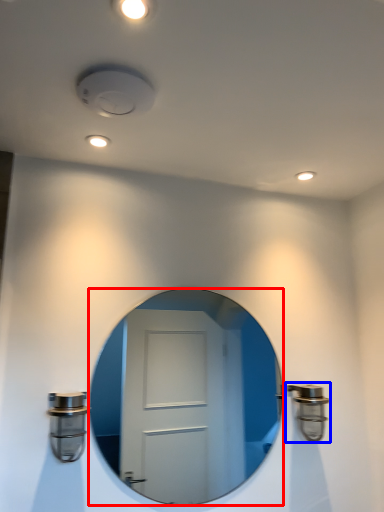
Question: Which object is further to the camera taking this photo, mirror (highlighted by a red box) or door handle (highlighted by a blue box)?

Choices:
 (A) mirror
 (B) door handle

Answer: (B)